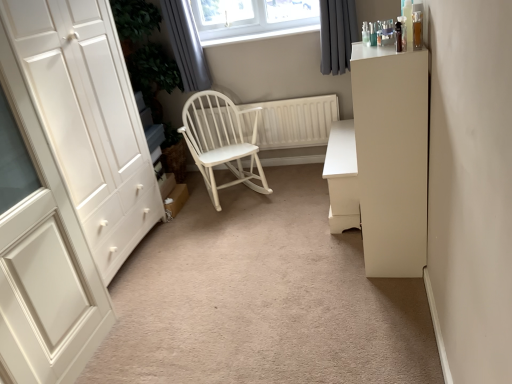
Question: From the image's perspective, is white wood wardrobe at left located above white wood rocking chair at center?

Choices:
 (A) no
 (B) yes

Answer: (A)

Question: Is white wood wardrobe at left smaller than white wood rocking chair at center?

Choices:
 (A) yes
 (B) no

Answer: (A)

Question: Can you confirm if white wood wardrobe at left is taller than white wood rocking chair at center?

Choices:
 (A) no
 (B) yes

Answer: (A)

Question: Is the position of white wood wardrobe at left more distant than that of white wood rocking chair at center?

Choices:
 (A) no
 (B) yes

Answer: (A)

Question: Is white wood wardrobe at left closer to camera compared to white wood rocking chair at center?

Choices:
 (A) no
 (B) yes

Answer: (B)

Question: Considering the relative sizes of white wood wardrobe at left and white wood rocking chair at center in the image provided, is white wood wardrobe at left wider than white wood rocking chair at center?

Choices:
 (A) yes
 (B) no

Answer: (A)

Question: Could you tell me if white wood rocking chair at center is facing white wood radiator at center?

Choices:
 (A) yes
 (B) no

Answer: (B)

Question: Is white wood rocking chair at center outside white wood radiator at center?

Choices:
 (A) yes
 (B) no

Answer: (A)

Question: Is the surface of white wood rocking chair at center in direct contact with white wood radiator at center?

Choices:
 (A) no
 (B) yes

Answer: (A)

Question: From the image's perspective, is white wood rocking chair at center located above white wood radiator at center?

Choices:
 (A) yes
 (B) no

Answer: (B)

Question: From the image's perspective, is white wood rocking chair at center beneath white wood radiator at center?

Choices:
 (A) no
 (B) yes

Answer: (B)

Question: Is white wood rocking chair at center positioned with its back to white wood radiator at center?

Choices:
 (A) yes
 (B) no

Answer: (A)

Question: Is white wood radiator at center bigger than dark grey fabric curtain at upper right, the second curtain when ordered from left to right?

Choices:
 (A) no
 (B) yes

Answer: (B)